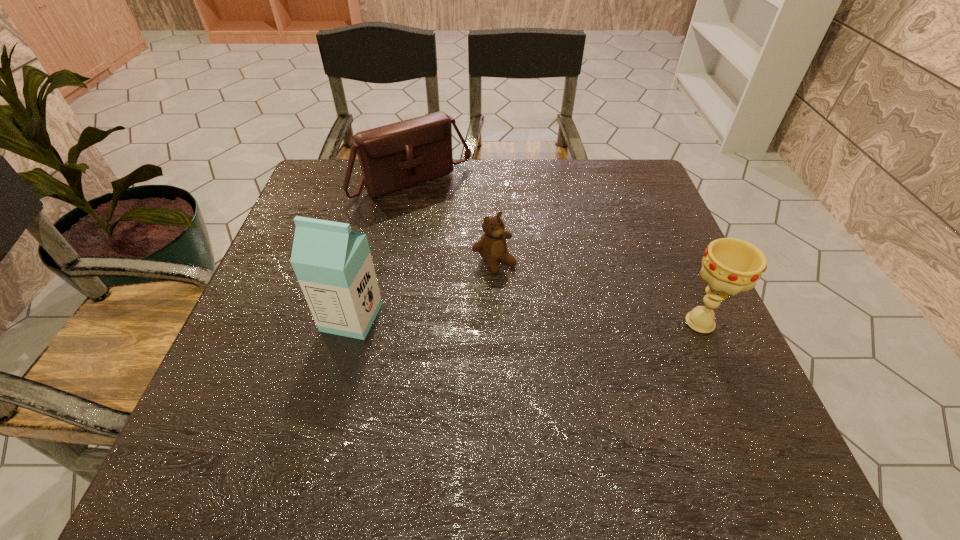
Find the location of a particular element. The width and height of the screenshot is (960, 540). vacant space in between the shoulder bag and the third object from left to right is located at coordinates (453, 222).

This screenshot has height=540, width=960. What are the coordinates of `vacant region between the milk carton and the teddy bear` in the screenshot? It's located at (423, 289).

Image resolution: width=960 pixels, height=540 pixels. Find the location of `unoccupied position between the shoulder bag and the rightmost object`. unoccupied position between the shoulder bag and the rightmost object is located at coordinates (556, 252).

This screenshot has width=960, height=540. Find the location of `object that ranks as the third closest to the third object from left to right`. object that ranks as the third closest to the third object from left to right is located at coordinates (729, 266).

Identify which object is the third closest to the tallest object. Please provide its 2D coordinates. Your answer should be formatted as a tuple, i.e. [(x, y)], where the tuple contains the x and y coordinates of a point satisfying the conditions above.

[(729, 266)]

The height and width of the screenshot is (540, 960). I want to click on vacant space that satisfies the following two spatial constraints: 1. on the front side of the milk carton; 2. on the right side of the rightmost object, so click(x=350, y=322).

You are a GUI agent. You are given a task and a screenshot of the screen. Output one action in this format:
    pyautogui.click(x=<x>, y=<y>)
    Task: Click on the blank space that satisfies the following two spatial constraints: 1. on the front side of the third object from left to right; 2. on the left side of the rightmost object
    
    Given the screenshot: What is the action you would take?
    pyautogui.click(x=496, y=322)